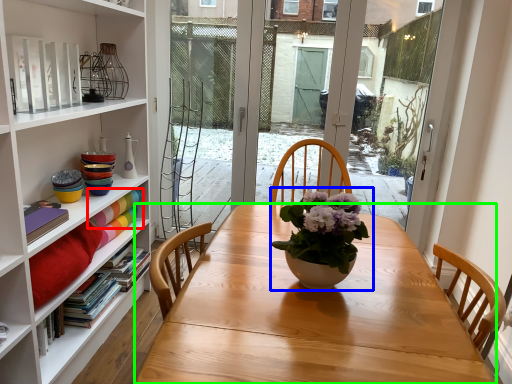
Question: Which object is positioned closest to book (highlighted by a red box)? Select from houseplant (highlighted by a blue box) and desk (highlighted by a green box).

Choices:
 (A) houseplant
 (B) desk

Answer: (B)